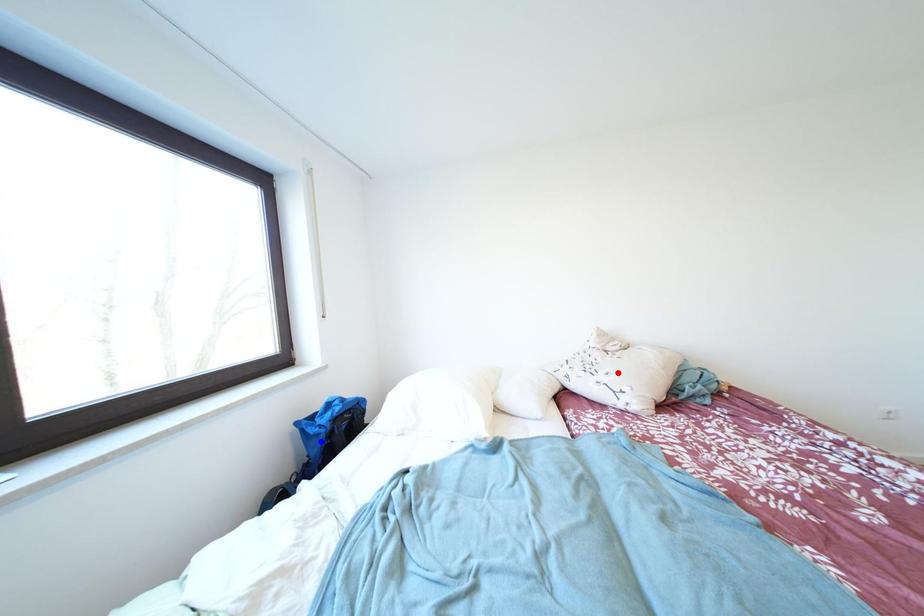
Question: Which of the two points in the image is closer to the camera?

Choices:
 (A) Blue point is closer.
 (B) Red point is closer.

Answer: (A)